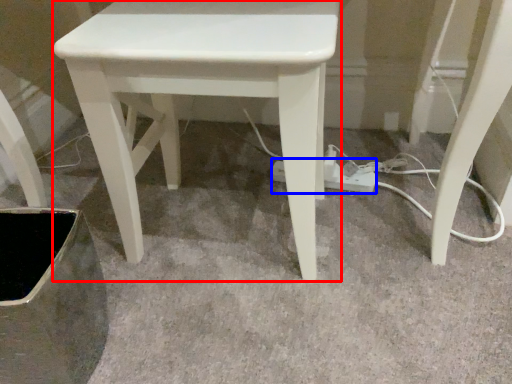
Question: Which object appears farthest to the camera in this image, stool (highlighted by a red box) or extension cord (highlighted by a blue box)?

Choices:
 (A) stool
 (B) extension cord

Answer: (B)